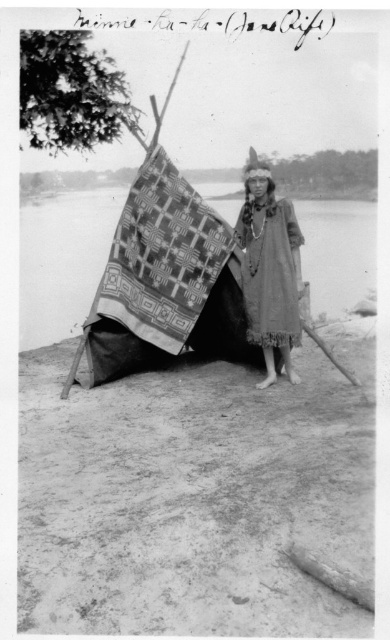
Is point (209, 243) in front of point (290, 260)?

No, (209, 243) is behind (290, 260).

Measure the distance between patterned fabric blanket at center and camera.

7.65 meters

Find the location of a particular element. patterned fabric blanket at center is located at coordinates (161, 257).

This screenshot has width=390, height=640. I want to click on patterned fabric blanket at center, so click(161, 257).